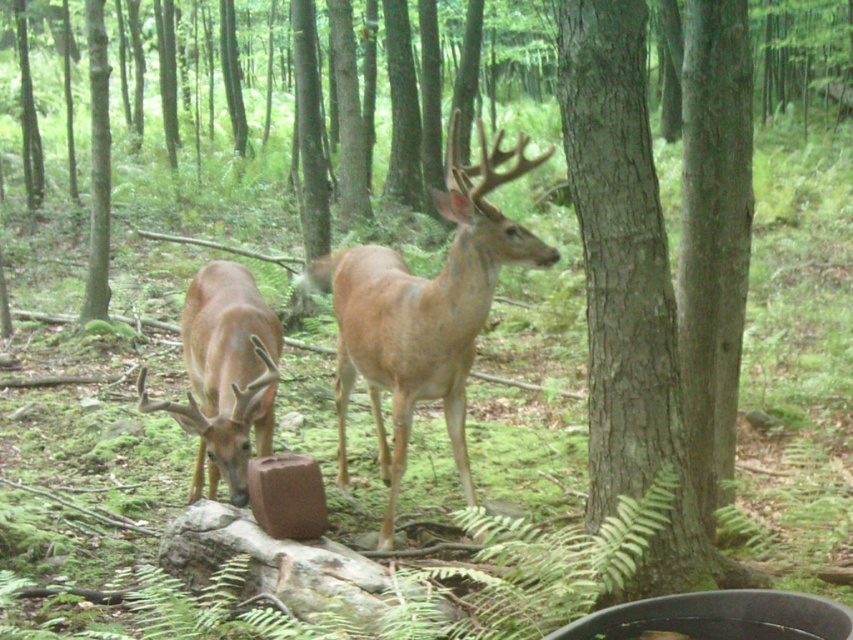
Who is shorter, light brown fur at center or brown matte deer at left?

light brown fur at center is shorter.

Between light brown fur at center and brown matte deer at left, which one appears on the right side from the viewer's perspective?

light brown fur at center

Who is more forward, (338, 324) or (235, 364)?

Point (235, 364)

You are a GUI agent. You are given a task and a screenshot of the screen. Output one action in this format:
    pyautogui.click(x=<x>, y=<y>)
    Task: Click on the light brown fur at center
    The height and width of the screenshot is (640, 853).
    Given the screenshot: What is the action you would take?
    pyautogui.click(x=424, y=310)

Does brown rough bark tree at center appear over brown matte deer at left?

Yes.

Which is in front, point (607, 500) or point (216, 324)?

Point (607, 500) is more forward.

Image resolution: width=853 pixels, height=640 pixels. In order to click on brown rough bark tree at center in this screenshot , I will do `click(625, 288)`.

How much distance is there between brown rough bark tree at center and light brown fur at center?

brown rough bark tree at center and light brown fur at center are 37.61 inches apart.

Is brown rough bark tree at center closer to camera compared to light brown fur at center?

Yes.

Where is `brown rough bark tree at center`? brown rough bark tree at center is located at coordinates (625, 288).